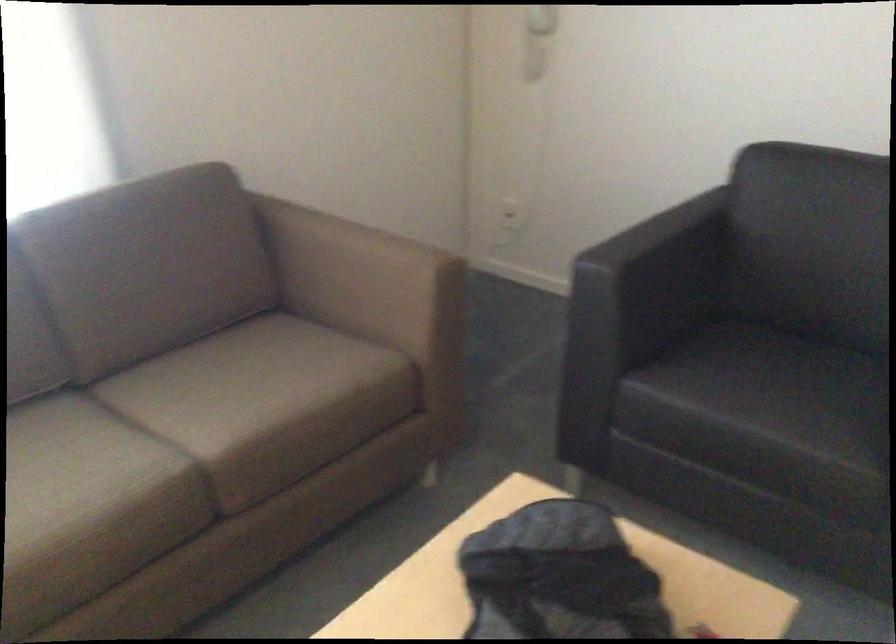
Which object does [511,214] point to?

It corresponds to the electrical outlet in the image.